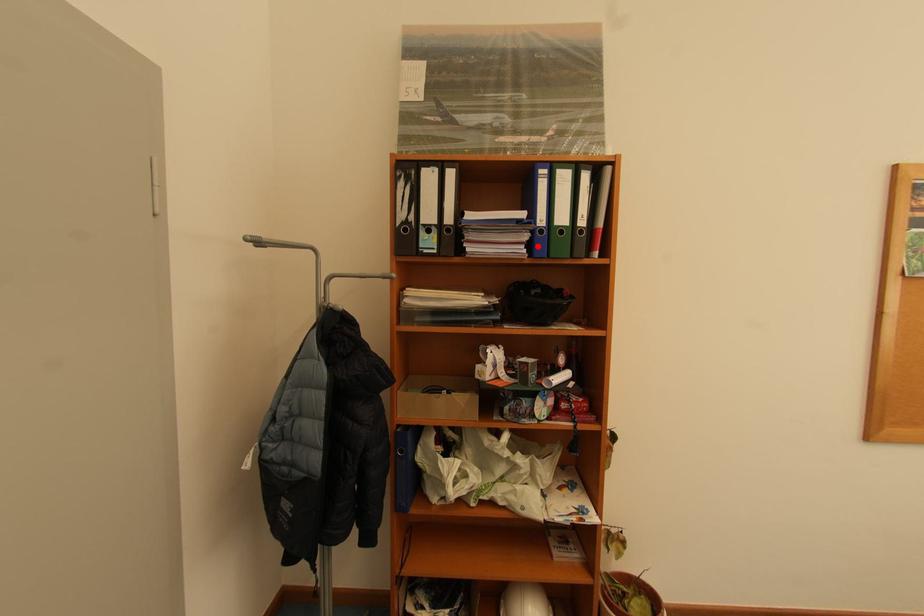
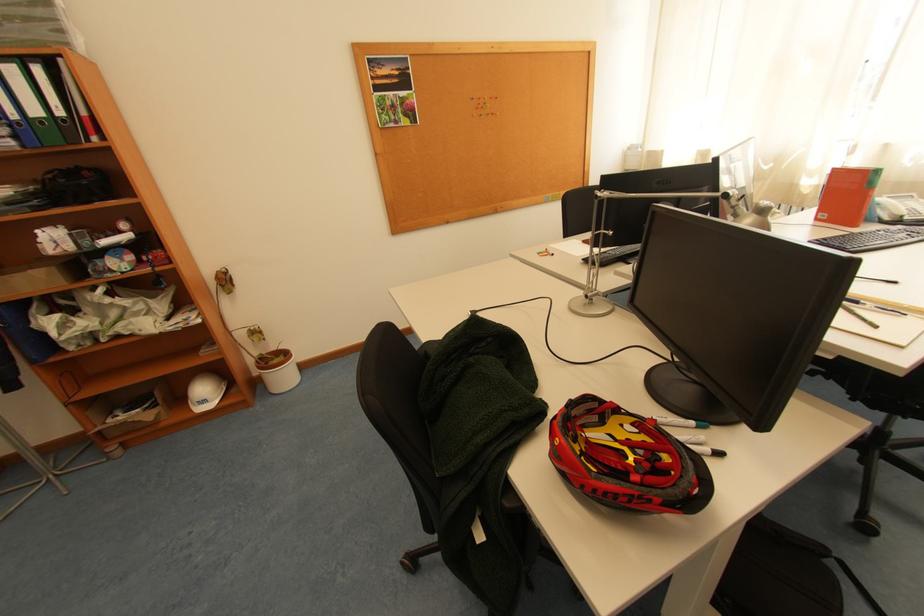
Question: I am providing you with two images of the same scene from different viewpoints. Image1 has a red point marked. In image2, the corresponding 3D location appears at what relative position? Reply with the corresponding letter.

Choices:
 (A) Closer
 (B) Farther

Answer: (B)